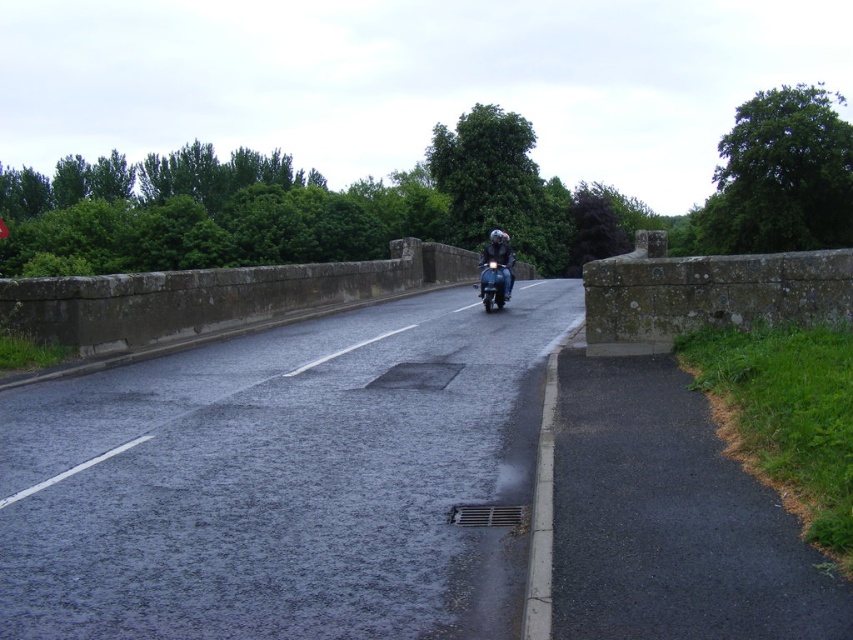
Question: Does glossy asphalt road at center have a larger size compared to shiny black helmet at center?

Choices:
 (A) no
 (B) yes

Answer: (A)

Question: Which point appears closest to the camera in this image?

Choices:
 (A) (492, 264)
 (B) (381, 456)
 (C) (502, 292)

Answer: (B)

Question: Which point is closer to the camera?

Choices:
 (A) (497, 266)
 (B) (257, 604)

Answer: (B)

Question: Can you confirm if shiny black helmet at center is positioned to the right of glossy black motorcycle at center?

Choices:
 (A) no
 (B) yes

Answer: (B)

Question: In this image, where is shiny black helmet at center located relative to glossy black motorcycle at center?

Choices:
 (A) right
 (B) left

Answer: (A)

Question: Which is farther from the glossy asphalt road at center?

Choices:
 (A) glossy black motorcycle at center
 (B) shiny black helmet at center

Answer: (B)